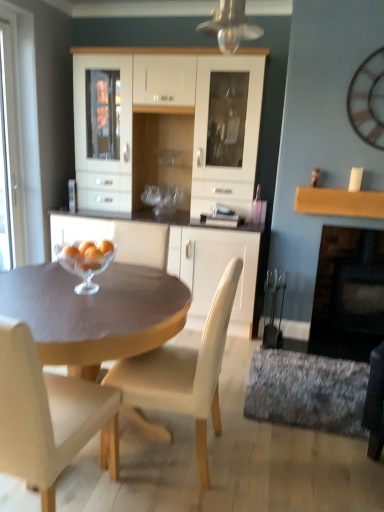
Locate an element on the screen. vacant area that lies in front of clear glass bowl at center is located at coordinates (76, 303).